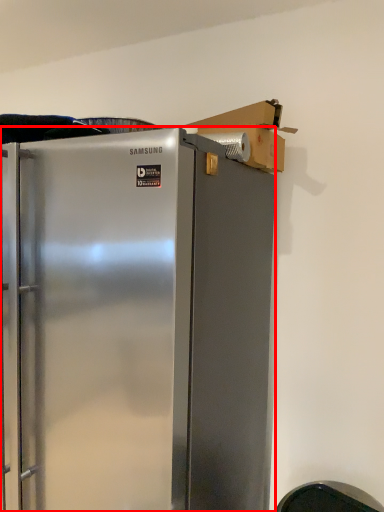
Question: From the image's perspective, where is refrigerator (annotated by the red box) located relative to cardboard box?

Choices:
 (A) above
 (B) below

Answer: (B)